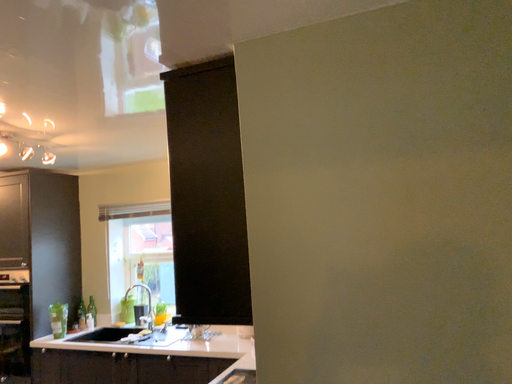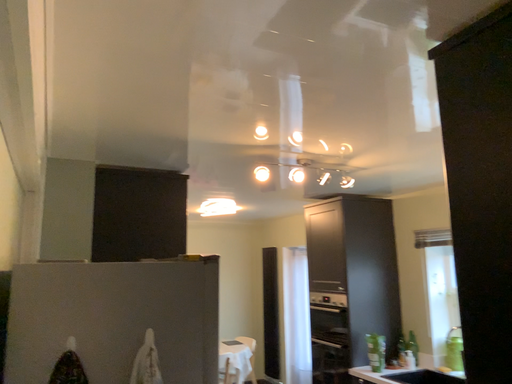
Question: How did the camera likely rotate when shooting the video?

Choices:
 (A) rotated left
 (B) rotated right

Answer: (A)